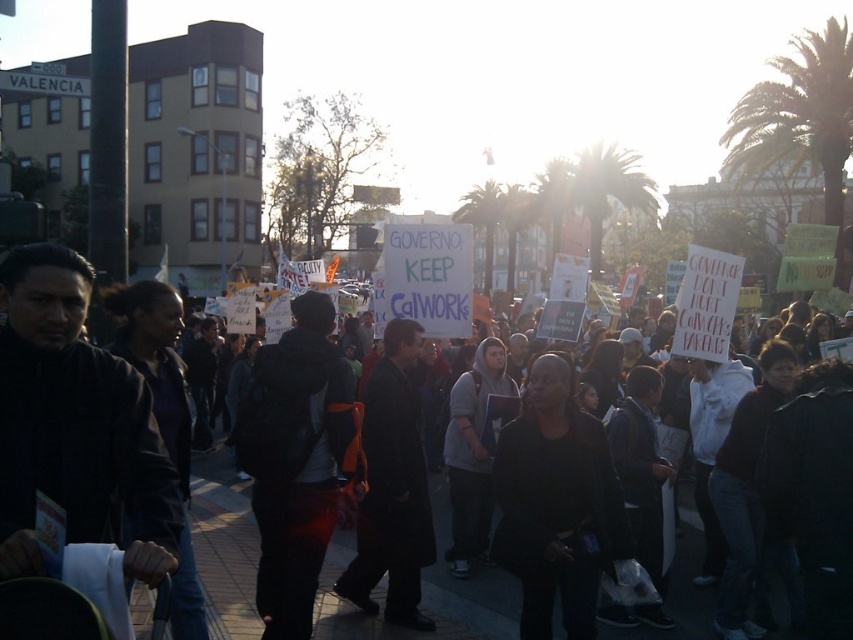
Is dark gray jacket at center wider than black matte jacket at center?

Yes.

Does dark gray jacket at center lie behind black matte jacket at center?

Yes, it is.

At what (x,y) coordinates should I click in order to perform the action: click on dark gray jacket at center. Please return your answer as a coordinate pair (x, y). The height and width of the screenshot is (640, 853). Looking at the image, I should click on (296, 460).

Which is in front, point (312, 320) or point (366, 436)?

Point (312, 320)

Measure the distance between point [302,308] and camera.

33.30 feet

Which is in front, point (265, 595) or point (421, 532)?

Point (265, 595)

Where is `dark gray jacket at center`? The image size is (853, 640). dark gray jacket at center is located at coordinates (296, 460).

Is point (323, 454) positioned after point (608, 189)?

No.

Which of these two, dark gray jacket at center or green leafy palm tree at upper center, stands shorter?

With less height is dark gray jacket at center.

Between point (299, 378) and point (590, 232), which one is positioned in front?

Point (299, 378)

Identify the location of dark gray jacket at center. (296, 460).